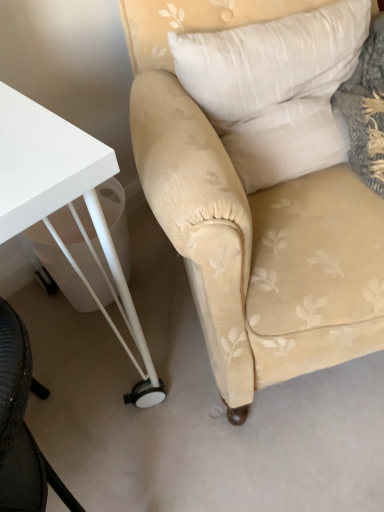
In order to click on vacant area situated below white glossy table at lower left (from a real-world perspective) in this screenshot , I will do `click(74, 360)`.